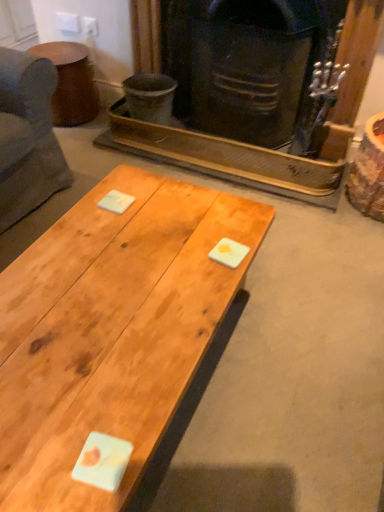
The width and height of the screenshot is (384, 512). Find the location of `vacant space to the right of natural wood coffee table at center`. vacant space to the right of natural wood coffee table at center is located at coordinates (299, 355).